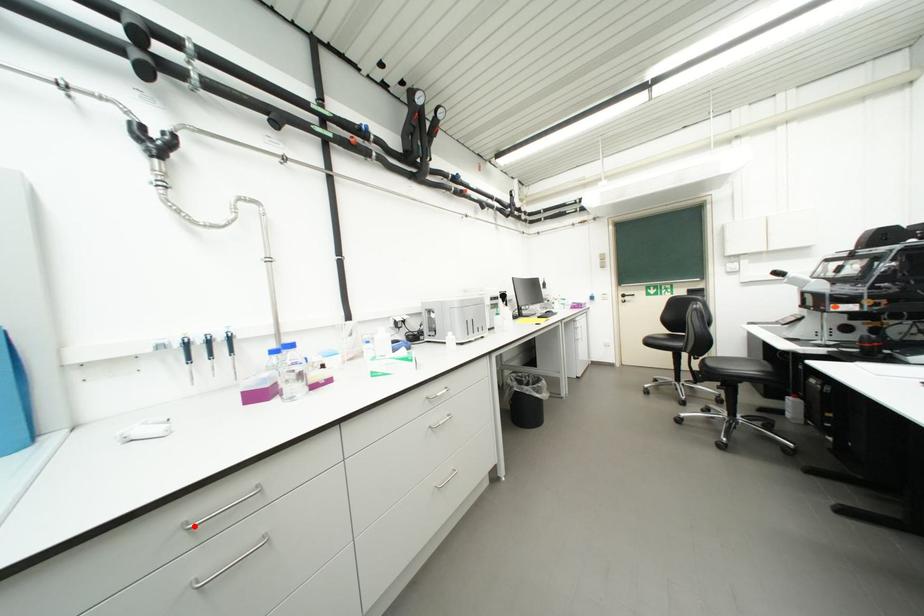
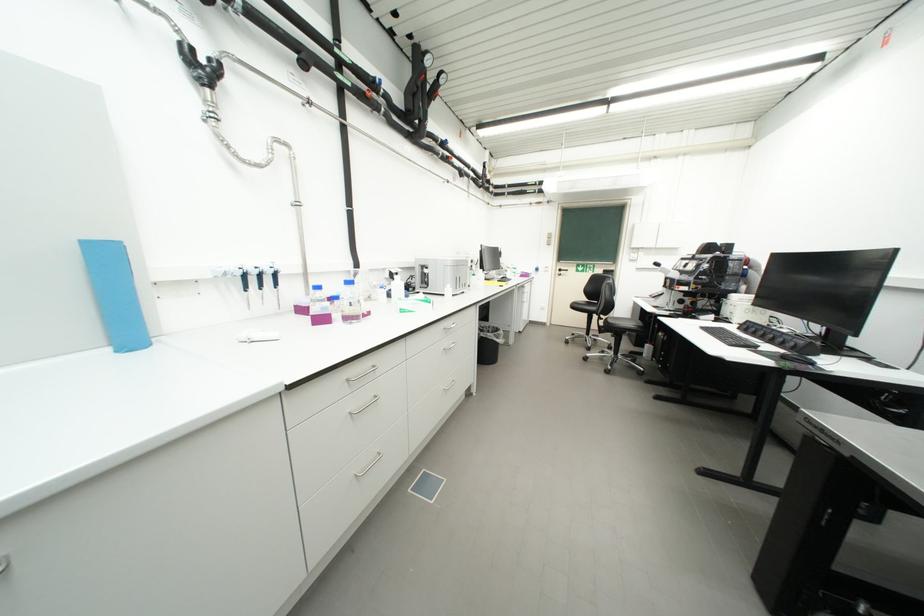
Find the pixel in the second image that matches the highlighted location in the first image.

(356, 381)